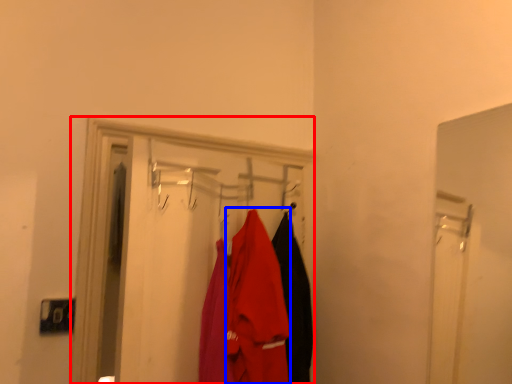
Question: Which object appears farthest to the camera in this image, closet (highlighted by a red box) or clothing (highlighted by a blue box)?

Choices:
 (A) closet
 (B) clothing

Answer: (B)